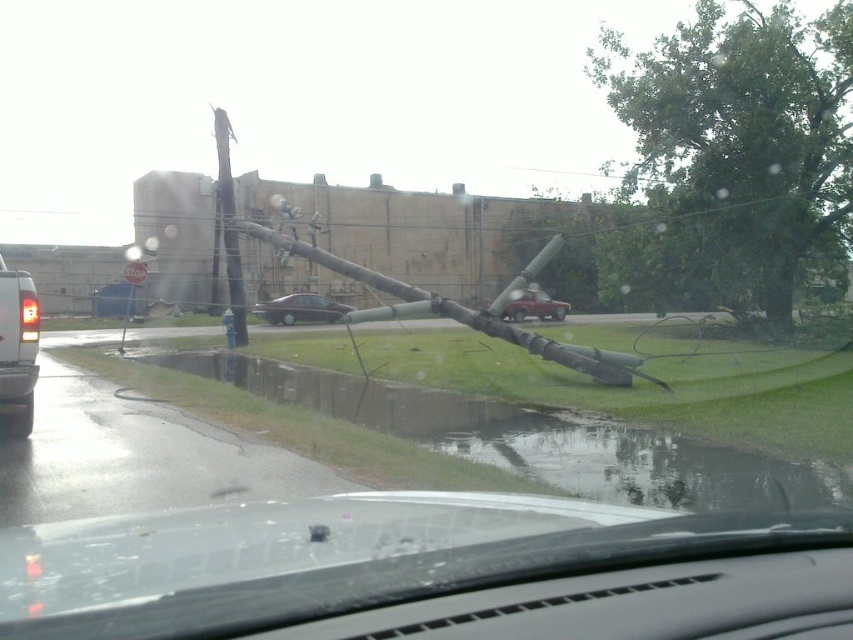
Does point (299, 321) lie in front of point (540, 314)?

Yes, point (299, 321) is in front of point (540, 314).

You are a GUI agent. You are given a task and a screenshot of the screen. Output one action in this format:
    pyautogui.click(x=<x>, y=<y>)
    Task: Click on the dark gray matte sedan at center
    Image resolution: width=853 pixels, height=640 pixels.
    Given the screenshot: What is the action you would take?
    pyautogui.click(x=300, y=308)

Does point (16, 284) lie in front of point (256, 310)?

Yes, point (16, 284) is in front of point (256, 310).

Does matte silver van at left have a greater height compared to dark gray matte sedan at center?

No.

The image size is (853, 640). What do you see at coordinates (16, 348) in the screenshot?
I see `matte silver van at left` at bounding box center [16, 348].

Find the location of a particular element. The width and height of the screenshot is (853, 640). matte silver van at left is located at coordinates (16, 348).

Can you confirm if matte silver van at left is smaller than matte red truck at center?

Yes, matte silver van at left is smaller than matte red truck at center.

Which is in front, point (15, 416) or point (532, 301)?

Point (15, 416) is in front.

In order to click on matte silver van at left in this screenshot , I will do `click(16, 348)`.